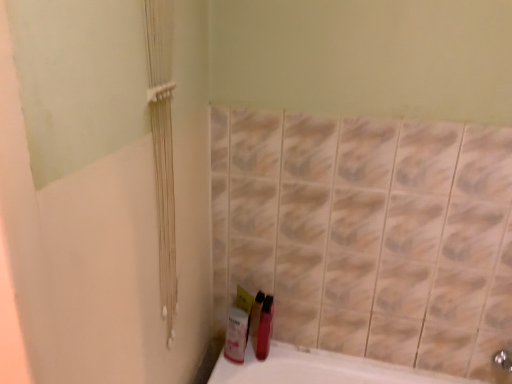
Question: Based on their sizes in the image, would you say white glossy mouthwash at lower center, the second mouthwash positioned from the right, is bigger or smaller than shiny red plastic mouthwash at lower center, the 1th mouthwash when ordered from right to left?

Choices:
 (A) big
 (B) small

Answer: (B)

Question: Considering the positions of point (243, 311) and point (261, 342), is point (243, 311) closer or farther from the camera than point (261, 342)?

Choices:
 (A) farther
 (B) closer

Answer: (B)

Question: Is white glossy mouthwash at lower center, the second mouthwash positioned from the right, inside the boundaries of shiny red plastic mouthwash at lower center, the 1th mouthwash when ordered from right to left, or outside?

Choices:
 (A) outside
 (B) inside

Answer: (A)

Question: Is shiny red plastic mouthwash at lower center, the 1th mouthwash when ordered from right to left, bigger or smaller than white glossy mouthwash at lower center, the second mouthwash positioned from the right?

Choices:
 (A) small
 (B) big

Answer: (B)

Question: Is shiny red plastic mouthwash at lower center, the 1th mouthwash when ordered from right to left, in front of or behind white glossy mouthwash at lower center, the second mouthwash positioned from the right, in the image?

Choices:
 (A) behind
 (B) front

Answer: (A)

Question: Would you say shiny red plastic mouthwash at lower center, the 1th mouthwash when ordered from right to left, is to the left or to the right of white glossy mouthwash at lower center, acting as the 1th mouthwash starting from the left, in the picture?

Choices:
 (A) right
 (B) left

Answer: (A)

Question: From the image's perspective, is shiny red plastic mouthwash at lower center, the 1th mouthwash when ordered from right to left, positioned above or below white glossy mouthwash at lower center, acting as the 1th mouthwash starting from the left?

Choices:
 (A) above
 (B) below

Answer: (A)